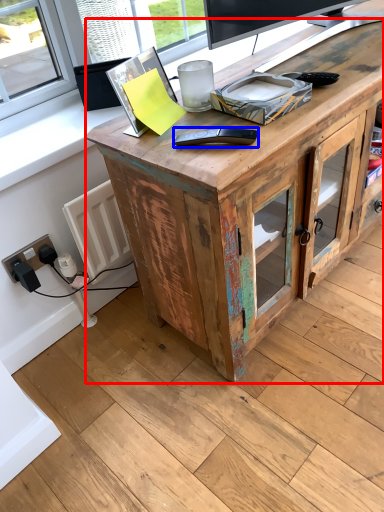
Question: Which of the following is the farthest to the observer, desk (highlighted by a red box) or equipment (highlighted by a blue box)?

Choices:
 (A) desk
 (B) equipment

Answer: (B)